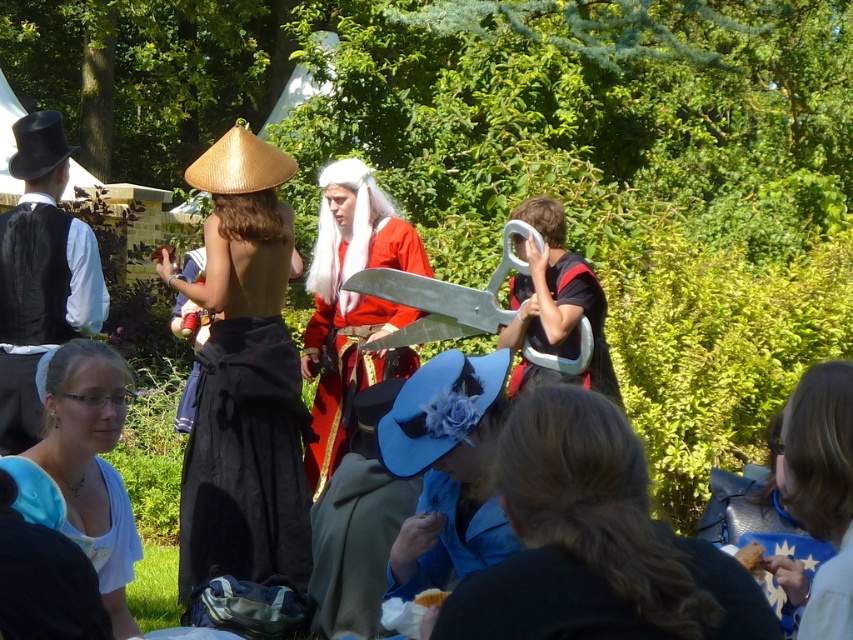
Question: Is blue fabric hat at lower center closer to camera compared to red velvet dress at center?

Choices:
 (A) yes
 (B) no

Answer: (A)

Question: Which of these objects is positioned closest to the blue fabric hat at lower center?

Choices:
 (A) blue fabric hat at lower right
 (B) matte black scissors at center
 (C) blue fabric robe at lower center
 (D) black velvet vest at left

Answer: (C)

Question: Which object appears closest to the camera in this image?

Choices:
 (A) blue fabric robe at lower center
 (B) blue satin hat at center

Answer: (A)

Question: Is red velvet dress at center thinner than matte black scissors at center?

Choices:
 (A) yes
 (B) no

Answer: (B)

Question: Can you confirm if bamboo hat at center is positioned above blue fabric shirt at lower left?

Choices:
 (A) no
 (B) yes

Answer: (B)

Question: Among these objects, which one is farthest from the camera?

Choices:
 (A) matte black scissors at center
 (B) bamboo hat at center
 (C) blue fabric hat at lower right
 (D) blue satin hat at center

Answer: (A)